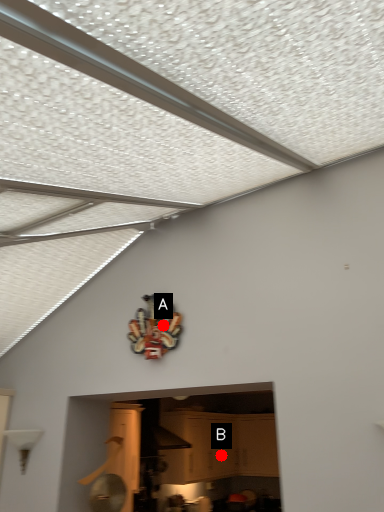
Question: Two points are circled on the image, labeled by A and B beside each circle. Which point appears farthest from the camera in this image?

Choices:
 (A) A is further
 (B) B is further

Answer: (B)